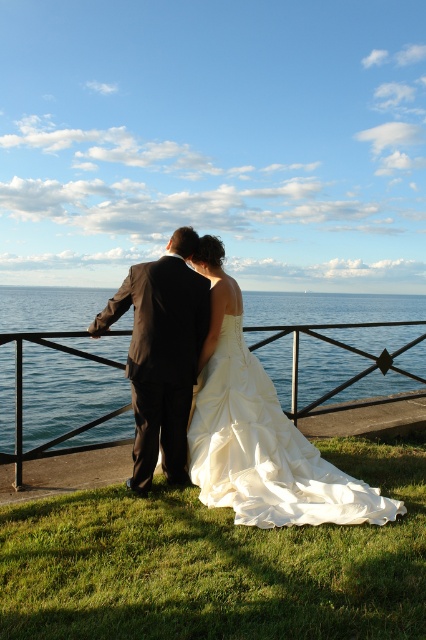
Question: Which of the following is the closest to the observer?

Choices:
 (A) (80, 353)
 (B) (222, 461)
 (C) (181, 451)
 (D) (218, 502)

Answer: (D)

Question: Can you confirm if ivory satin gown at center is wider than black metal railing at center?

Choices:
 (A) yes
 (B) no

Answer: (B)

Question: Which point is farther to the camera?

Choices:
 (A) (186, 429)
 (B) (273, 426)
 (C) (305, 452)

Answer: (C)

Question: Is matte white gown at center in front of black metal railing at center?

Choices:
 (A) no
 (B) yes

Answer: (B)

Question: Can you confirm if ivory satin gown at center is positioned below dark gray suit at center?

Choices:
 (A) no
 (B) yes

Answer: (B)

Question: Which is nearer to the matte white gown at center?

Choices:
 (A) black metal railing at center
 (B) dark gray suit at center
 (C) ivory satin gown at center

Answer: (C)